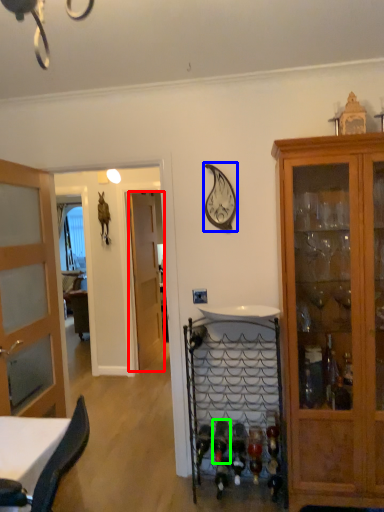
Question: Estimate the real-world distances between objects in this image. Which object is farther from door (highlighted by a red box), clock (highlighted by a blue box) or wine bottle (highlighted by a green box)?

Choices:
 (A) clock
 (B) wine bottle

Answer: (A)